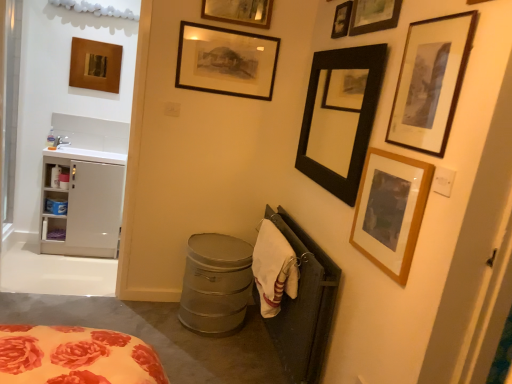
Question: Should I look upward or downward to see metallic gray trash can at lower center?

Choices:
 (A) down
 (B) up

Answer: (A)

Question: Is wooden framed picture at upper center, the sixth picture frame from the right, positioned in front of white glossy sink at left?

Choices:
 (A) yes
 (B) no

Answer: (A)

Question: Can you confirm if wooden framed picture at upper center, the sixth picture frame from the right, is positioned to the right of white glossy sink at left?

Choices:
 (A) no
 (B) yes

Answer: (B)

Question: From a real-world perspective, is wooden framed picture at upper center, the sixth picture frame from the right, positioned under white glossy sink at left based on gravity?

Choices:
 (A) yes
 (B) no

Answer: (B)

Question: Is wooden framed picture at upper center, the sixth picture frame from the right, thinner than white glossy sink at left?

Choices:
 (A) no
 (B) yes

Answer: (B)

Question: Considering the relative positions of wooden framed picture at upper center, which ranks as the 3th picture frame in left-to-right order, and white glossy sink at left in the image provided, is wooden framed picture at upper center, which ranks as the 3th picture frame in left-to-right order, behind white glossy sink at left?

Choices:
 (A) yes
 (B) no

Answer: (B)

Question: Can you confirm if wooden framed print at upper right, the 8th picture frame positioned from the left, is bigger than black matte picture frame at upper right, which is the 5th picture frame from right to left?

Choices:
 (A) yes
 (B) no

Answer: (B)

Question: From the image's perspective, is wooden framed print at upper right, the 1th picture frame when ordered from right to left, beneath black matte picture frame at upper right, the fourth picture frame positioned from the left?

Choices:
 (A) yes
 (B) no

Answer: (A)

Question: From a real-world perspective, is wooden framed print at upper right, the 1th picture frame when ordered from right to left, positioned under black matte picture frame at upper right, the fourth picture frame positioned from the left, based on gravity?

Choices:
 (A) no
 (B) yes

Answer: (A)

Question: Is wooden framed print at upper right, the 1th picture frame when ordered from right to left, looking in the opposite direction of black matte picture frame at upper right, which is the 5th picture frame from right to left?

Choices:
 (A) no
 (B) yes

Answer: (A)

Question: Is wooden framed print at upper right, the 1th picture frame when ordered from right to left, not within black matte picture frame at upper right, the fourth picture frame positioned from the left?

Choices:
 (A) yes
 (B) no

Answer: (A)

Question: Does wooden framed print at upper right, the 8th picture frame positioned from the left, lie behind black matte picture frame at upper right, which is the 5th picture frame from right to left?

Choices:
 (A) no
 (B) yes

Answer: (A)

Question: From the image's perspective, is wooden picture frame at upper left, the 1th picture frame from the left, beneath white plastic cabinet at left?

Choices:
 (A) yes
 (B) no

Answer: (B)